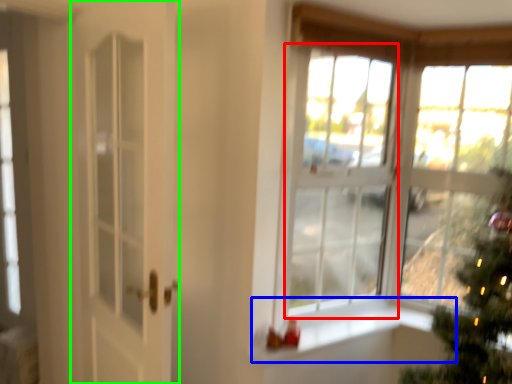
Question: Which object is the farthest from window (highlighted by a red box)? Choose among these: window sill (highlighted by a blue box) or door (highlighted by a green box).

Choices:
 (A) window sill
 (B) door

Answer: (B)